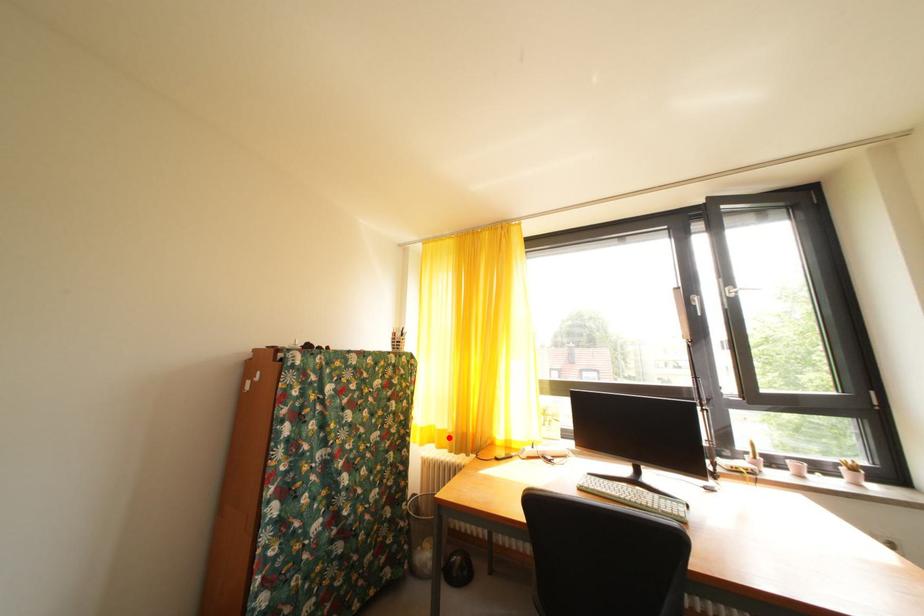
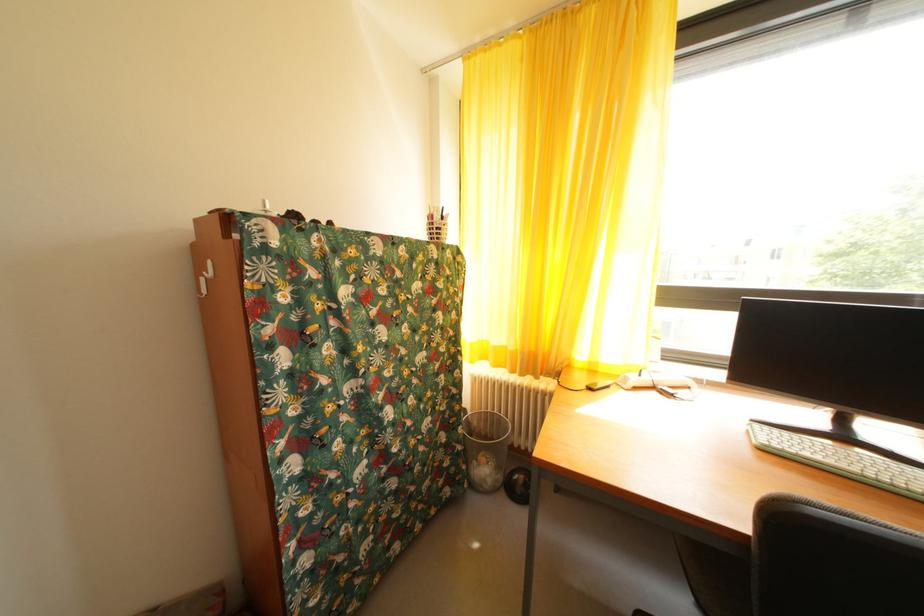
Question: I am providing you with two images of the same scene from different viewpoints. A red point is marked on the first image. At the location where the point appears in image 1, is it still visible in image 2?

Choices:
 (A) Yes
 (B) No

Answer: (A)